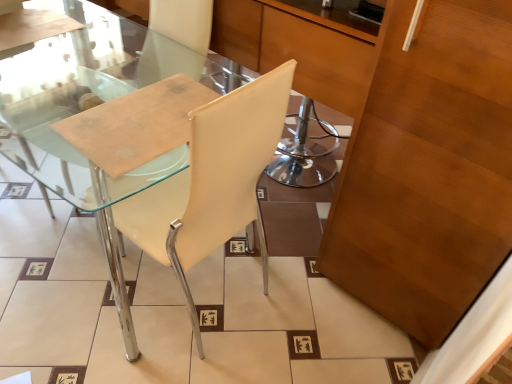
Question: Does wooden cabinet at right lie behind transparent glass table at left?

Choices:
 (A) yes
 (B) no

Answer: (B)

Question: From the image's perspective, is wooden cabinet at right beneath transparent glass table at left?

Choices:
 (A) yes
 (B) no

Answer: (A)

Question: Does wooden cabinet at right have a lesser height compared to transparent glass table at left?

Choices:
 (A) no
 (B) yes

Answer: (A)

Question: Is wooden cabinet at right outside transparent glass table at left?

Choices:
 (A) no
 (B) yes

Answer: (B)

Question: Is wooden cabinet at right facing away from transparent glass table at left?

Choices:
 (A) yes
 (B) no

Answer: (B)

Question: Can you confirm if wooden cabinet at right is thinner than transparent glass table at left?

Choices:
 (A) yes
 (B) no

Answer: (B)

Question: Does wooden cabinet at right appear on the right side of white leather chair at center?

Choices:
 (A) yes
 (B) no

Answer: (A)

Question: Is wooden cabinet at right wider than white leather chair at center?

Choices:
 (A) yes
 (B) no

Answer: (A)

Question: From the image's perspective, is wooden cabinet at right below white leather chair at center?

Choices:
 (A) no
 (B) yes

Answer: (A)

Question: Is wooden cabinet at right oriented towards white leather chair at center?

Choices:
 (A) yes
 (B) no

Answer: (B)

Question: Is wooden cabinet at right further to the viewer compared to white leather chair at center?

Choices:
 (A) yes
 (B) no

Answer: (B)

Question: Does wooden cabinet at right come in front of white leather chair at center?

Choices:
 (A) no
 (B) yes

Answer: (B)

Question: Is transparent glass table at left further to the viewer compared to white leather chair at center?

Choices:
 (A) no
 (B) yes

Answer: (B)